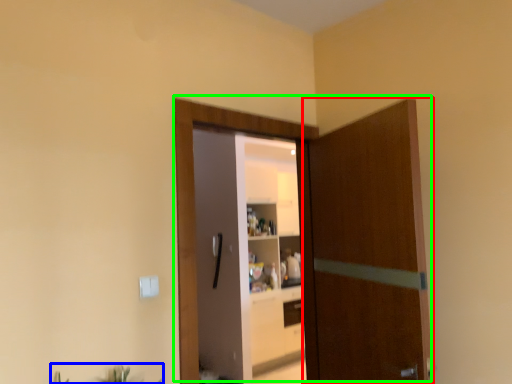
Question: Which object is the closest to the door (highlighted by a red box)? Choose among these: plant (highlighted by a blue box) or door (highlighted by a green box).

Choices:
 (A) plant
 (B) door

Answer: (B)